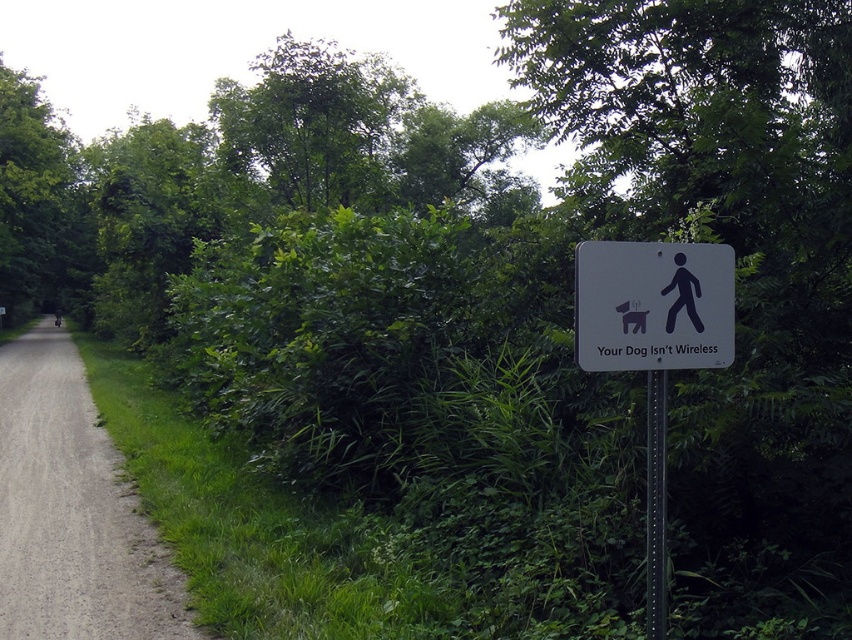
Question: Is gray gravel path at left thinner than white plastic sign at center-right?

Choices:
 (A) no
 (B) yes

Answer: (A)

Question: Can you confirm if white plastic sign at center-right is positioned below black metal pole at right?

Choices:
 (A) yes
 (B) no

Answer: (B)

Question: Among these points, which one is farthest from the camera?

Choices:
 (A) (734, 342)
 (B) (16, 624)
 (C) (625, 296)
 (D) (677, 285)

Answer: (B)

Question: Can you confirm if white plastic sign at center right is bigger than black metal pole at right?

Choices:
 (A) yes
 (B) no

Answer: (A)

Question: Which is farther from the black metal pole at right?

Choices:
 (A) gray gravel path at left
 (B) black plastic figure at upper center
 (C) white plastic sign at center right
 (D) white plastic sign at center-right

Answer: (A)

Question: Which point appears closest to the camera in this image?

Choices:
 (A) (60, 316)
 (B) (704, 282)
 (C) (73, 636)

Answer: (B)